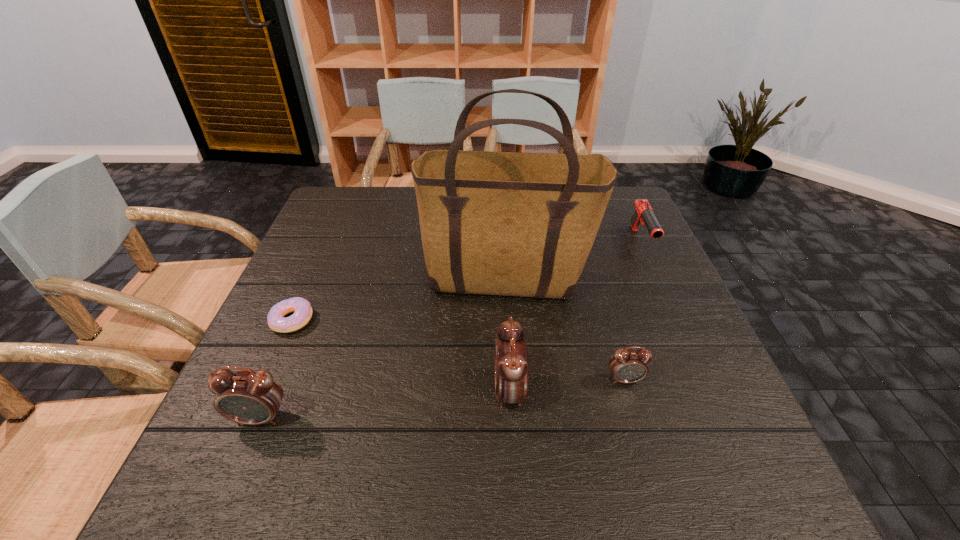
Where is `object at the far right corner`? Image resolution: width=960 pixels, height=540 pixels. object at the far right corner is located at coordinates (644, 213).

This screenshot has width=960, height=540. In the image, there is a desktop. In order to click on vacant space at the far edge in this screenshot , I will do `click(403, 194)`.

What are the coordinates of `free space at the near edge` in the screenshot? It's located at (602, 416).

Locate an element on the screen. The height and width of the screenshot is (540, 960). vacant space at the left edge of the desktop is located at coordinates (342, 282).

Where is `free space at the right edge`? The image size is (960, 540). free space at the right edge is located at coordinates (695, 322).

This screenshot has height=540, width=960. Identify the location of vacant space at the far left corner. (326, 196).

Where is `vacant area at the far right corner`? vacant area at the far right corner is located at coordinates (629, 228).

In the image, there is a desktop. What are the coordinates of `vacant space at the near right corner` in the screenshot? It's located at [660, 404].

Locate an element on the screen. unoccupied area between the tote bag and the rightmost alarm clock is located at coordinates (565, 331).

You are a GUI agent. You are given a task and a screenshot of the screen. Output one action in this format:
    pyautogui.click(x=<x>, y=<y>)
    Task: Click on the vacant space in between the second alarm clock from right to left and the rightmost object
    The image size is (960, 540).
    Given the screenshot: What is the action you would take?
    pyautogui.click(x=575, y=316)